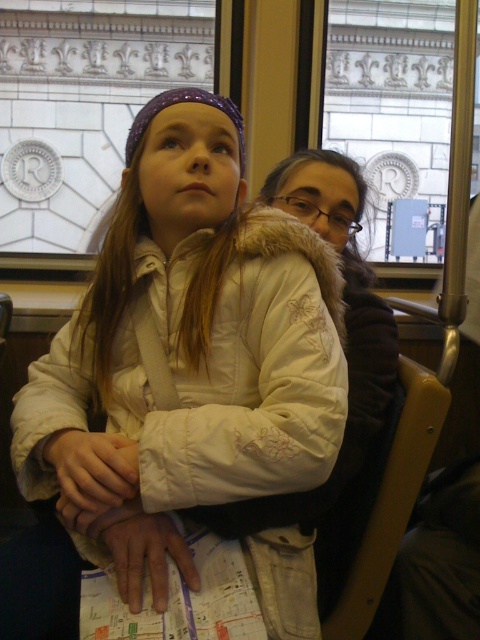
From the picture: You are a fashion designer observing two coats in the subway car. The coats are labeled as the white fuzzy coat at center and the white fur coat at center. Which of these two coats is larger in size?

The white fuzzy coat at center is bigger than the white fur coat at center, so the white fuzzy coat at center is the larger one.

You are standing in the subway car and need to locate the white fuzzy coat at center. According to the coordinates provided, where would you look to find it?

The white fuzzy coat at center is located at coordinates point (x=178, y=358).